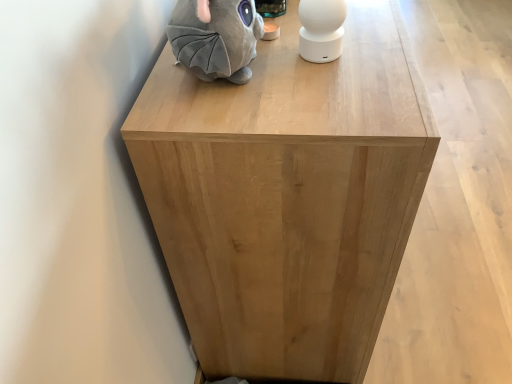
The height and width of the screenshot is (384, 512). I want to click on vacant area that lies between white matte speaker at upper center, which is counted as the first toy, starting from the right, and gray plush toy at upper left, marked as the 2th toy in a right-to-left arrangement, so click(295, 71).